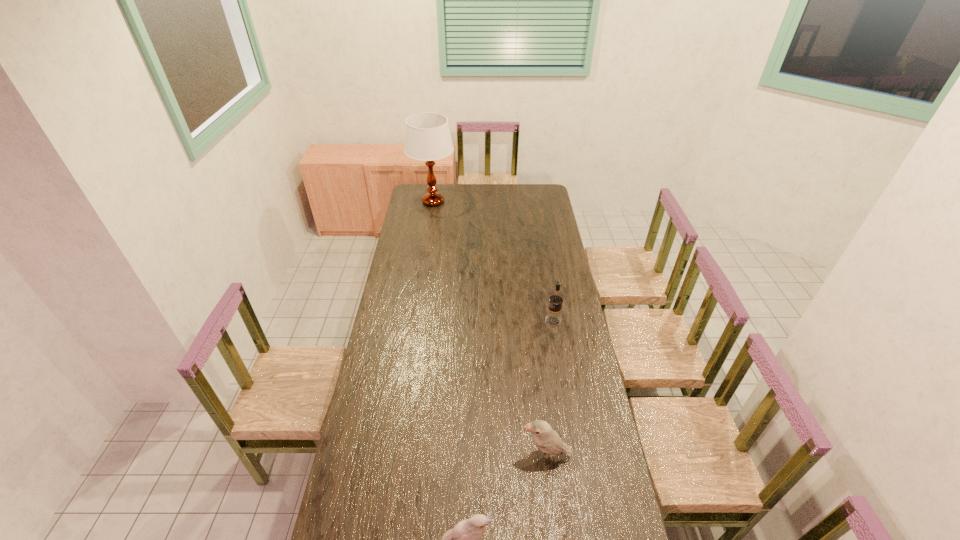
This screenshot has height=540, width=960. I want to click on free area in between the vodka and the leftmost object, so click(493, 261).

I want to click on free space between the farthest object and the third nearest object, so click(493, 261).

Find the location of a particular element. empty space that is in between the tallest object and the vodka is located at coordinates (493, 261).

Find the location of a particular element. The height and width of the screenshot is (540, 960). free spot between the tallest object and the right bird is located at coordinates (490, 329).

You are a GUI agent. You are given a task and a screenshot of the screen. Output one action in this format:
    pyautogui.click(x=<x>, y=<y>)
    Task: Click on the free spot between the taller bird and the vodka
    
    Given the screenshot: What is the action you would take?
    pyautogui.click(x=549, y=388)

Locate an element on the screen. The width and height of the screenshot is (960, 540). vacant space that is in between the vodka and the taller bird is located at coordinates (549, 388).

The image size is (960, 540). I want to click on the second closest object to the tallest object, so click(x=547, y=440).

Point out which object is positioned as the nearest to the third farthest object. Please provide its 2D coordinates. Your answer should be formatted as a tuple, i.e. [(x, y)], where the tuple contains the x and y coordinates of a point satisfying the conditions above.

[(462, 539)]